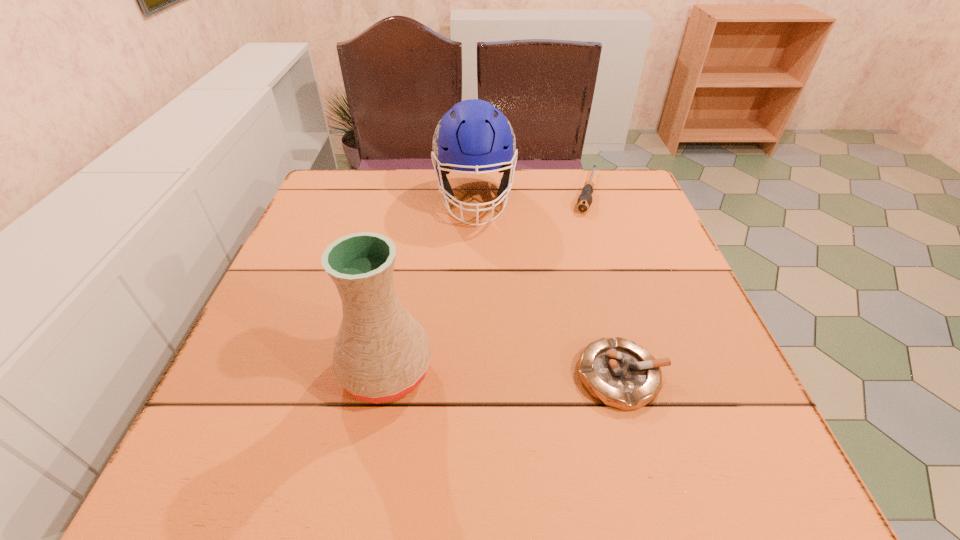
The image size is (960, 540). What are the coordinates of `vacant space on the desktop that is between the pottery and the ashtray and is positioned at the tip of the screwdriver` in the screenshot? It's located at (534, 374).

The width and height of the screenshot is (960, 540). What are the coordinates of `vacant spot on the desktop that is between the pottery and the ashtray and is positioned on the face guard of the football helmet` in the screenshot? It's located at (488, 373).